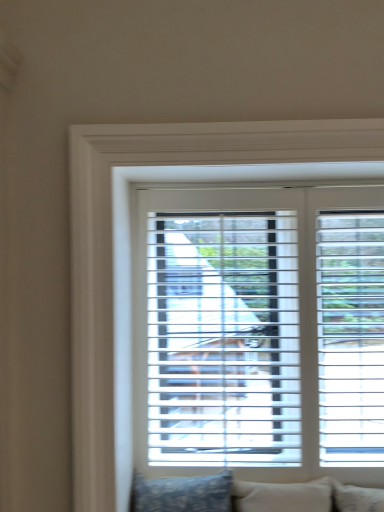
Question: Considering the positions of beige fabric pillow at lower center, which is the 1th pillow from right to left, and blue patterned pillow at lower center, which ranks as the second pillow in right-to-left order, in the image, is beige fabric pillow at lower center, which is the 1th pillow from right to left, bigger or smaller than blue patterned pillow at lower center, which ranks as the second pillow in right-to-left order,?

Choices:
 (A) big
 (B) small

Answer: (B)

Question: Is beige fabric pillow at lower center, which is the 1th pillow from right to left, in front of or behind blue patterned pillow at lower center, which ranks as the second pillow in right-to-left order, in the image?

Choices:
 (A) front
 (B) behind

Answer: (B)

Question: Estimate the real-world distances between objects in this image. Which object is closer to the white plastic blinds at center?

Choices:
 (A) beige fabric pillow at lower center, which is the 1th pillow from right to left
 (B) blue patterned pillow at lower center, arranged as the 1th pillow when viewed from the left

Answer: (B)

Question: Estimate the real-world distances between objects in this image. Which object is farther from the blue patterned pillow at lower center, which ranks as the second pillow in right-to-left order?

Choices:
 (A) white plastic blinds at center
 (B) beige fabric pillow at lower center, which is the 1th pillow from right to left

Answer: (A)